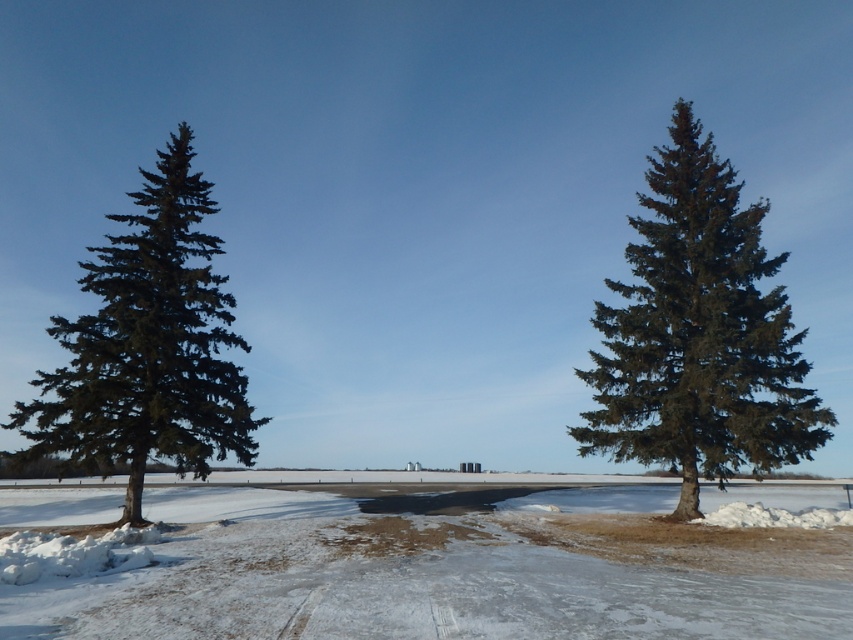
Question: Is the position of white fluffy snow at center less distant than that of green matte tree at center?

Choices:
 (A) yes
 (B) no

Answer: (A)

Question: Which point is closer to the camera?

Choices:
 (A) (108, 552)
 (B) (773, 442)

Answer: (A)

Question: Estimate the real-world distances between objects in this image. Which object is closer to the green matte evergreen tree at left?

Choices:
 (A) white fluffy snow at center
 (B) green matte tree at center

Answer: (A)

Question: Does white fluffy snow at center have a smaller size compared to green matte tree at center?

Choices:
 (A) no
 (B) yes

Answer: (B)

Question: Does white fluffy snow at center have a smaller size compared to green matte tree at center?

Choices:
 (A) no
 (B) yes

Answer: (B)

Question: Which point appears farthest from the camera in this image?

Choices:
 (A) (653, 339)
 (B) (701, 592)
 (C) (207, 458)

Answer: (A)